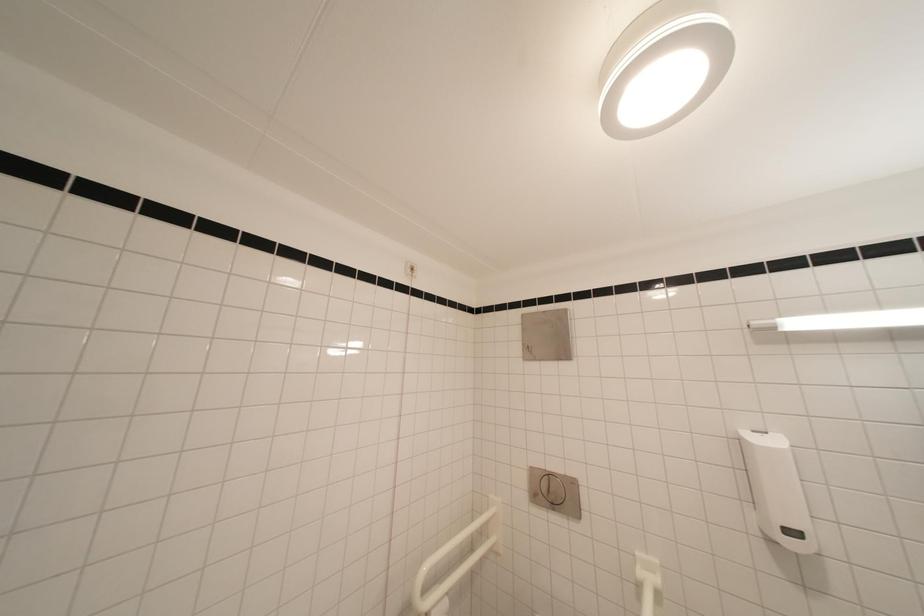
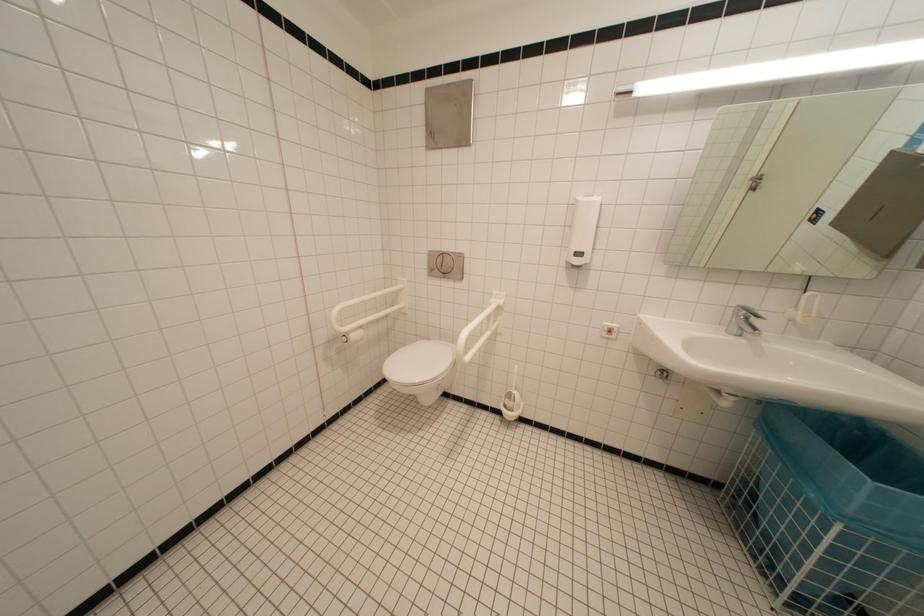
The first image is from the beginning of the video and the second image is from the end. How did the camera likely rotate when shooting the video?

The camera rotated toward right-down.